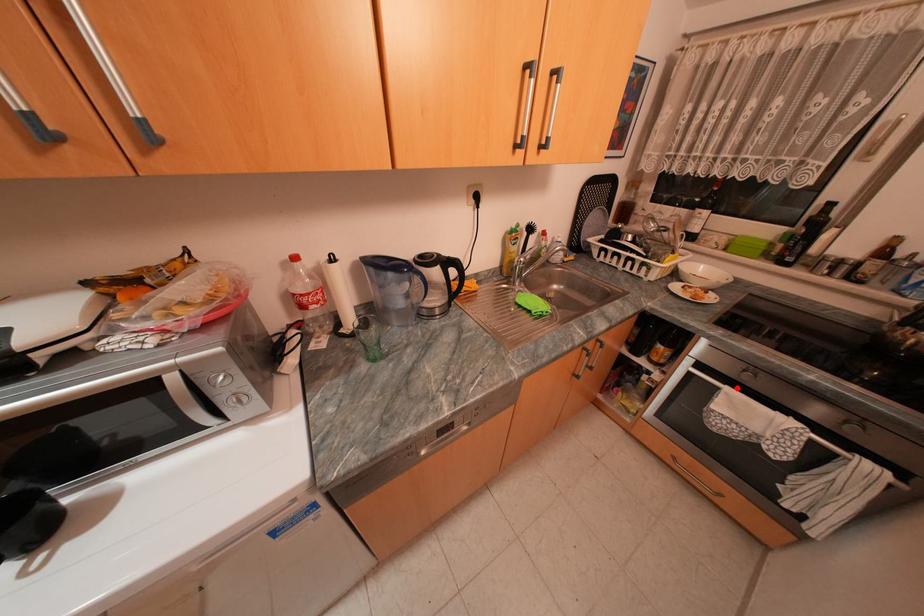
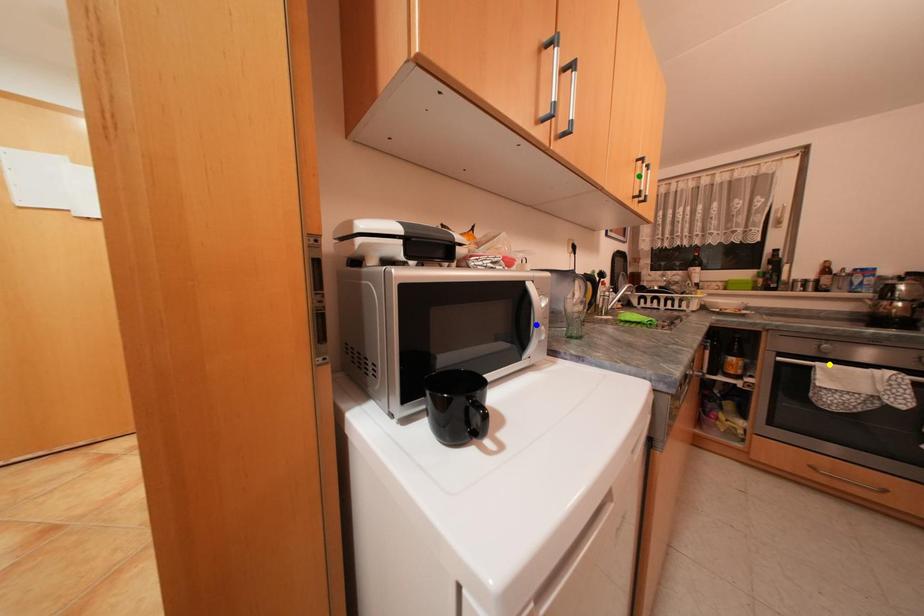
Question: I am providing you with two images of the same scene from different viewpoints. A red point is marked on the first image. You are given multiple points on the second image. In image 2, which mark is for the same physical point as the one in image 1?

Choices:
 (A) green point
 (B) blue point
 (C) yellow point

Answer: (C)